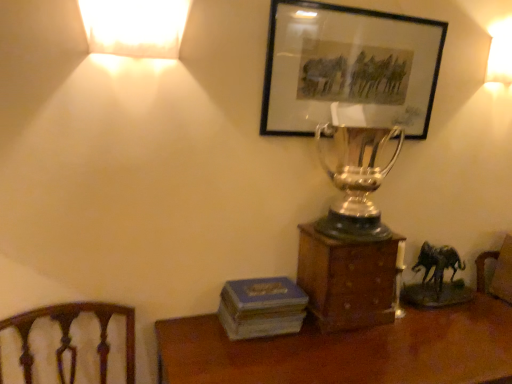
Question: From a real-world perspective, is blue matte book at lower center located higher than wooden box at center?

Choices:
 (A) yes
 (B) no

Answer: (B)

Question: Can you confirm if blue matte book at lower center is shorter than wooden box at center?

Choices:
 (A) no
 (B) yes

Answer: (B)

Question: Considering the relative sizes of blue matte book at lower center and wooden box at center in the image provided, is blue matte book at lower center bigger than wooden box at center?

Choices:
 (A) yes
 (B) no

Answer: (B)

Question: Does blue matte book at lower center have a smaller size compared to wooden box at center?

Choices:
 (A) yes
 (B) no

Answer: (A)

Question: Is there a large distance between blue matte book at lower center and wooden box at center?

Choices:
 (A) no
 (B) yes

Answer: (A)

Question: Is wooden box at center located within blue matte book at lower center?

Choices:
 (A) no
 (B) yes

Answer: (A)

Question: From the image's perspective, is matte white lampshade at upper left, which is counted as the first lamp, starting from the front, on top of matte black picture frame at upper center?

Choices:
 (A) no
 (B) yes

Answer: (B)

Question: Can you confirm if matte white lampshade at upper left, placed as the second lamp when sorted from back to front, is thinner than matte black picture frame at upper center?

Choices:
 (A) no
 (B) yes

Answer: (A)

Question: Is matte white lampshade at upper left, which is the first lamp from left to right, to the left of matte black picture frame at upper center from the viewer's perspective?

Choices:
 (A) no
 (B) yes

Answer: (B)

Question: Is the position of matte white lampshade at upper left, placed as the second lamp when sorted from back to front, more distant than that of matte black picture frame at upper center?

Choices:
 (A) no
 (B) yes

Answer: (A)

Question: Considering the relative sizes of matte white lampshade at upper left, placed as the second lamp when sorted from back to front, and matte black picture frame at upper center in the image provided, is matte white lampshade at upper left, placed as the second lamp when sorted from back to front, taller than matte black picture frame at upper center?

Choices:
 (A) no
 (B) yes

Answer: (A)

Question: Is matte white lampshade at upper right, the 2th lamp viewed from the front, bigger than wooden box at center?

Choices:
 (A) no
 (B) yes

Answer: (A)